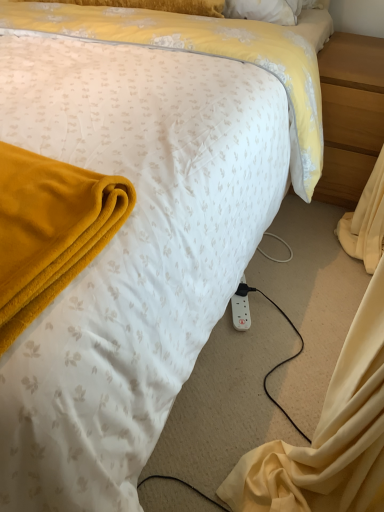
Identify the location of free space that is in between light brown wood at right and white plastic power outlet at lower right. (292, 253).